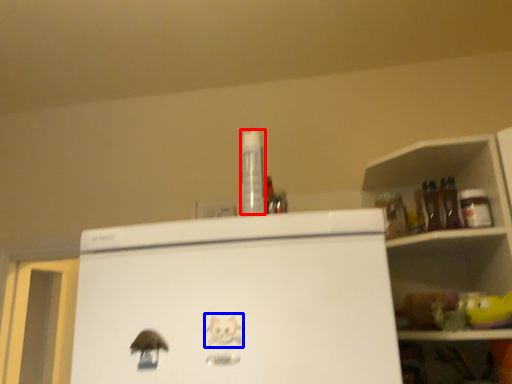
Question: Which of the following is the closest to the observer, bottle (highlighted by a red box) or animal (highlighted by a blue box)?

Choices:
 (A) bottle
 (B) animal

Answer: (B)